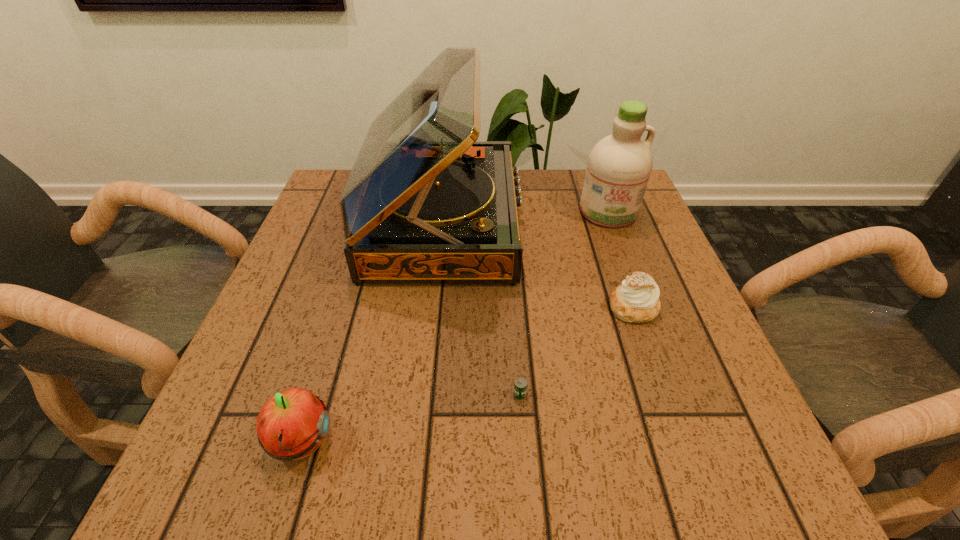
Image resolution: width=960 pixels, height=540 pixels. I want to click on free point that satisfies the following two spatial constraints: 1. on the front-facing side of the record player; 2. on the back side of the pastry, so click(x=433, y=307).

Locate an element on the screen. The image size is (960, 540). vacant region that satisfies the following two spatial constraints: 1. on the back side of the shortest object; 2. on the front-facing side of the record player is located at coordinates (507, 222).

Find the location of a particular element. This screenshot has height=540, width=960. free space in the image that satisfies the following two spatial constraints: 1. on the front-facing side of the fourth tallest object; 2. on the right side of the tallest object is located at coordinates (433, 307).

Where is `free space that satisfies the following two spatial constraints: 1. on the front label of the cleansing agent; 2. on the front-facing side of the tallest object`? This screenshot has height=540, width=960. free space that satisfies the following two spatial constraints: 1. on the front label of the cleansing agent; 2. on the front-facing side of the tallest object is located at coordinates (612, 222).

Identify the location of free space that satisfies the following two spatial constraints: 1. on the front-facing side of the shortest object; 2. on the right side of the tallest object. (424, 394).

Find the location of a particular element. The image size is (960, 540). vacant area that satisfies the following two spatial constraints: 1. on the front label of the second tallest object; 2. on the front-facing side of the tallest object is located at coordinates (612, 222).

The image size is (960, 540). Identify the location of free region that satisfies the following two spatial constraints: 1. on the front label of the cleansing agent; 2. on the front-facing side of the tallest object. (612, 222).

Find the location of `vacant space that satisfies the following two spatial constraints: 1. on the front label of the second tallest object; 2. on the front-facing side of the record player`. vacant space that satisfies the following two spatial constraints: 1. on the front label of the second tallest object; 2. on the front-facing side of the record player is located at coordinates (612, 222).

Find the location of `free space that satisfies the following two spatial constraints: 1. on the back side of the beer can; 2. on the front-facing side of the tallest object`. free space that satisfies the following two spatial constraints: 1. on the back side of the beer can; 2. on the front-facing side of the tallest object is located at coordinates (507, 222).

Find the location of a particular element. free spot that satisfies the following two spatial constraints: 1. on the front-facing side of the record player; 2. on the right side of the beer can is located at coordinates (424, 394).